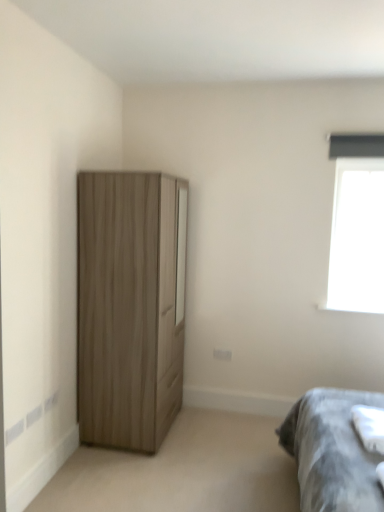
Identify the location of vacant space situated above gray fabric bedsheet at lower right (from a real-world perspective). (375, 419).